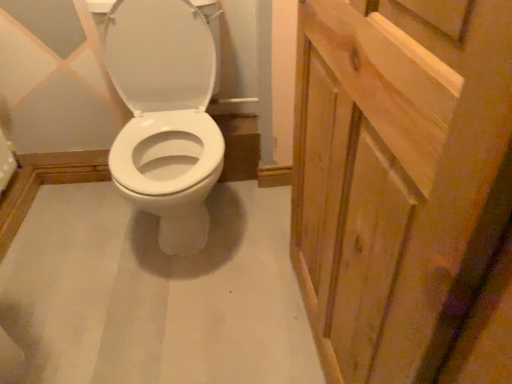
Question: From a real-world perspective, is natural wood screen door at right physically located above or below white glossy toilet seat at left?

Choices:
 (A) above
 (B) below

Answer: (A)

Question: Considering the positions of natural wood screen door at right and white glossy toilet seat at left in the image, is natural wood screen door at right wider or thinner than white glossy toilet seat at left?

Choices:
 (A) thin
 (B) wide

Answer: (A)

Question: In the image, is natural wood screen door at right positioned in front of or behind white glossy toilet seat at left?

Choices:
 (A) behind
 (B) front

Answer: (B)

Question: From a real-world perspective, is white glossy toilet seat at left above or below natural wood screen door at right?

Choices:
 (A) below
 (B) above

Answer: (A)

Question: Looking at their shapes, would you say white glossy toilet seat at left is wider or thinner than natural wood screen door at right?

Choices:
 (A) thin
 (B) wide

Answer: (B)

Question: Do you think white glossy toilet seat at left is within natural wood screen door at right, or outside of it?

Choices:
 (A) outside
 (B) inside

Answer: (A)

Question: From the image's perspective, is white glossy toilet seat at left positioned above or below natural wood screen door at right?

Choices:
 (A) above
 (B) below

Answer: (A)